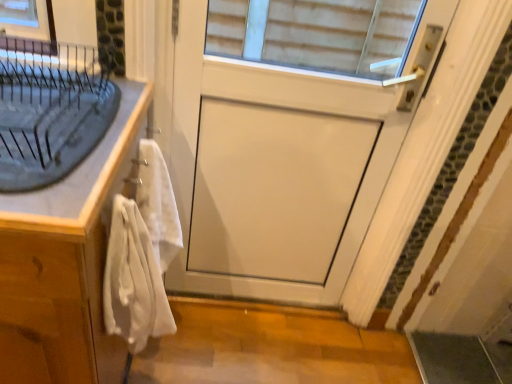
Question: Considering the positions of white cotton bath towel at left, arranged as the second bath towel when viewed from the back, and white matte door at center in the image, is white cotton bath towel at left, arranged as the second bath towel when viewed from the back, taller or shorter than white matte door at center?

Choices:
 (A) short
 (B) tall

Answer: (A)

Question: Based on their positions, is white cotton bath towel at left, arranged as the second bath towel when viewed from the back, located to the left or right of white matte door at center?

Choices:
 (A) right
 (B) left

Answer: (B)

Question: Estimate the real-world distances between objects in this image. Which object is farther from the white cotton bath towel at left, marked as the first bath towel in a front-to-back arrangement?

Choices:
 (A) matte gray sink at left
 (B) white soft towel at left, which ranks as the 1th bath towel in back-to-front order
 (C) white wood cabinet at left
 (D) white matte door at center

Answer: (D)

Question: Which of these objects is positioned closest to the white cotton bath towel at left, arranged as the second bath towel when viewed from the back?

Choices:
 (A) white soft towel at left, the second bath towel positioned from the front
 (B) matte gray sink at left
 (C) white wood cabinet at left
 (D) white matte door at center

Answer: (C)